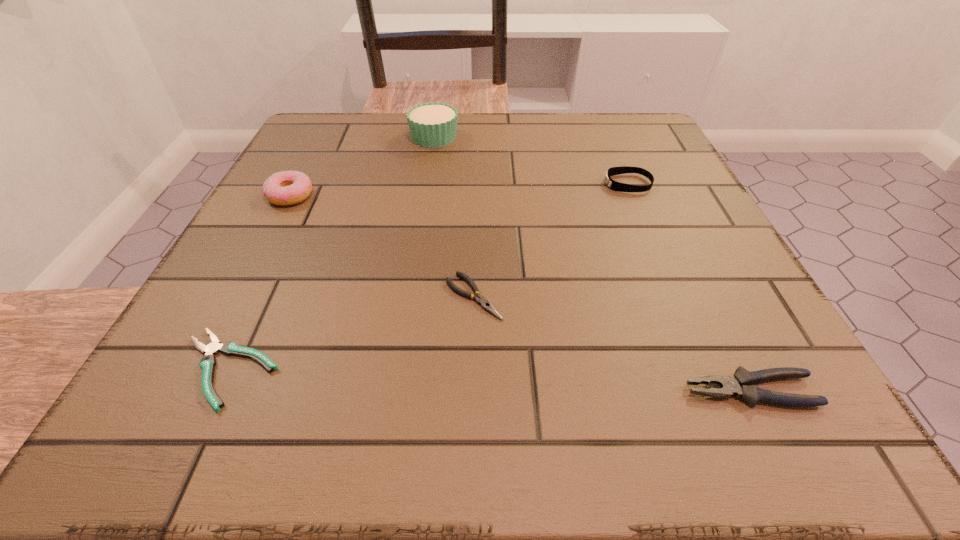
In order to click on blank space located 0.070m on the right of the fifth shortest object in this screenshot , I will do `click(348, 195)`.

Identify the location of vacant region located 0.400m on the display of the wristband. The image size is (960, 540). (410, 184).

I want to click on free region located 0.400m on the display of the wristband, so click(x=410, y=184).

This screenshot has height=540, width=960. I want to click on free space located on the display of the wristband, so click(492, 184).

You are a GUI agent. You are given a task and a screenshot of the screen. Output one action in this format:
    pyautogui.click(x=<x>, y=<y>)
    Task: Click on the free space located 0.310m at the gripping part of the tallest pliers
    
    Given the screenshot: What is the action you would take?
    pyautogui.click(x=445, y=390)

I want to click on free location located at the gripping part of the tallest pliers, so point(485,390).

You are a GUI agent. You are given a task and a screenshot of the screen. Output one action in this format:
    pyautogui.click(x=<x>, y=<y>)
    Task: Click on the blank space located 0.110m at the gripping part of the tallest pliers
    This screenshot has height=540, width=960.
    Given the screenshot: What is the action you would take?
    [x=601, y=390]

You are a GUI agent. You are given a task and a screenshot of the screen. Output one action in this format:
    pyautogui.click(x=<x>, y=<y>)
    Task: Click on the free spot located 0.110m on the left of the second shortest pliers
    
    Given the screenshot: What is the action you would take?
    pyautogui.click(x=373, y=296)

I want to click on free spot located 0.140m on the right of the shortest pliers, so point(384,368).

Image resolution: width=960 pixels, height=540 pixels. Find the location of `object that is at the far edge`. object that is at the far edge is located at coordinates (434, 124).